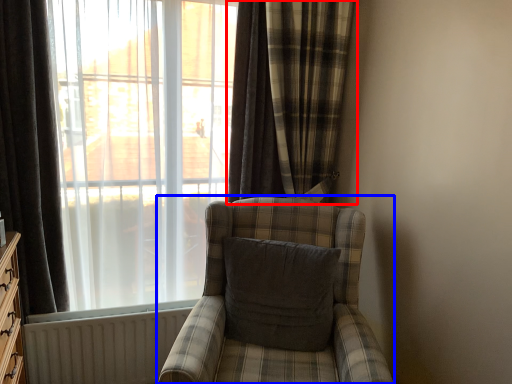
Question: Which of the following is the farthest to the observer, curtain (highlighted by a red box) or chair (highlighted by a blue box)?

Choices:
 (A) curtain
 (B) chair

Answer: (A)